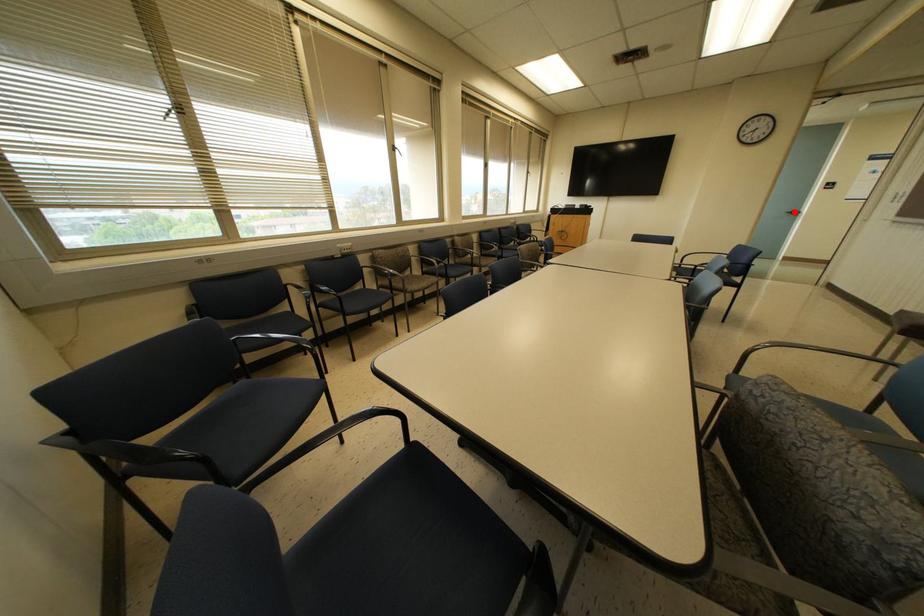
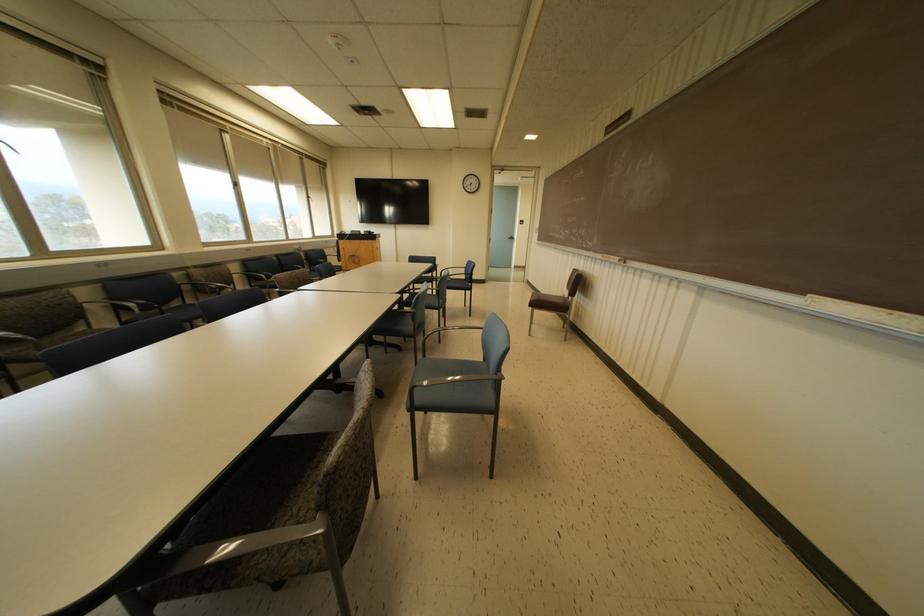
Find the pixel in the second image that matches the highlighted location in the first image.

(512, 238)